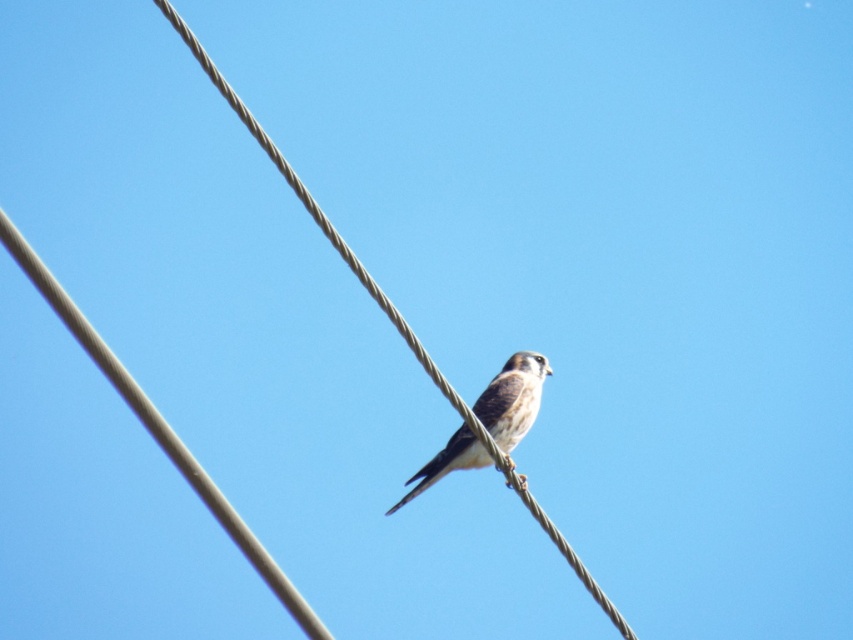
You are a birdwatcher observing a small falcon perched on a wire in the sky. You notice the gray wire at center and the brown speckled feathers at center. Which object is taller in the image?

The gray wire at center is much taller than the brown speckled feathers at center.